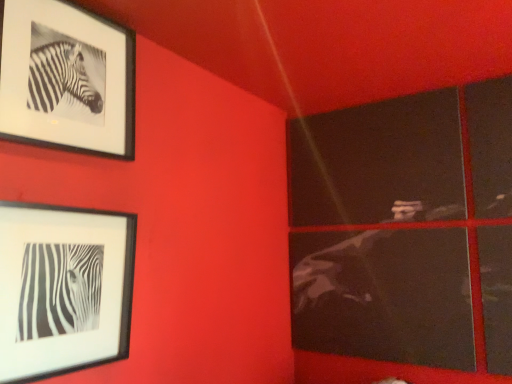
Where is `black matte picture frame at upper left, which is counted as the 1th picture frame, starting from the top`? This screenshot has height=384, width=512. black matte picture frame at upper left, which is counted as the 1th picture frame, starting from the top is located at coordinates (67, 78).

What do you see at coordinates (67, 78) in the screenshot? This screenshot has width=512, height=384. I see `black matte picture frame at upper left, arranged as the 2th picture frame when ordered from the bottom` at bounding box center [67, 78].

Locate an element on the screen. black matte picture frame at lower left, placed as the first picture frame when sorted from bottom to top is located at coordinates (63, 289).

What do you see at coordinates (63, 289) in the screenshot? I see `black matte picture frame at lower left, the 2th picture frame from the top` at bounding box center [63, 289].

Image resolution: width=512 pixels, height=384 pixels. What are the coordinates of `black matte picture frame at upper left, arranged as the 2th picture frame when ordered from the bottom` in the screenshot? It's located at (67, 78).

In the image, is black matte picture frame at lower left, placed as the first picture frame when sorted from bottom to top, on the left side or the right side of black matte picture frame at upper left, arranged as the 2th picture frame when ordered from the bottom?

From the image, it's evident that black matte picture frame at lower left, placed as the first picture frame when sorted from bottom to top, is to the right of black matte picture frame at upper left, arranged as the 2th picture frame when ordered from the bottom.

Is black matte picture frame at lower left, the 2th picture frame from the top, further to camera compared to black matte picture frame at upper left, which is counted as the 1th picture frame, starting from the top?

No.

Considering the points (124, 244) and (6, 21), which point is behind, point (124, 244) or point (6, 21)?

Positioned behind is point (124, 244).

From the image's perspective, between black matte picture frame at lower left, the 2th picture frame from the top, and black matte picture frame at upper left, which is counted as the 1th picture frame, starting from the top, which one is located above?

black matte picture frame at upper left, which is counted as the 1th picture frame, starting from the top, from the image's perspective.

From a real-world perspective, which object rests below the other?

black matte picture frame at lower left, the 2th picture frame from the top.

Considering the sizes of black matte picture frame at lower left, the 2th picture frame from the top, and black matte picture frame at upper left, which is counted as the 1th picture frame, starting from the top, in the image, is black matte picture frame at lower left, the 2th picture frame from the top, wider or thinner than black matte picture frame at upper left, which is counted as the 1th picture frame, starting from the top,?

black matte picture frame at lower left, the 2th picture frame from the top, is wider than black matte picture frame at upper left, which is counted as the 1th picture frame, starting from the top.

Between black matte picture frame at lower left, the 2th picture frame from the top, and black matte picture frame at upper left, which is counted as the 1th picture frame, starting from the top, which one has less height?

black matte picture frame at lower left, the 2th picture frame from the top.

Is black matte picture frame at lower left, the 2th picture frame from the top, smaller than black matte picture frame at upper left, which is counted as the 1th picture frame, starting from the top?

No.

Is black matte picture frame at lower left, the 2th picture frame from the top, not inside black matte picture frame at upper left, which is counted as the 1th picture frame, starting from the top?

Yes, black matte picture frame at lower left, the 2th picture frame from the top, is not within black matte picture frame at upper left, which is counted as the 1th picture frame, starting from the top.

Are black matte picture frame at lower left, placed as the first picture frame when sorted from bottom to top, and black matte picture frame at upper left, arranged as the 2th picture frame when ordered from the bottom, beside each other?

No, black matte picture frame at lower left, placed as the first picture frame when sorted from bottom to top, is not beside black matte picture frame at upper left, arranged as the 2th picture frame when ordered from the bottom.

Is black matte picture frame at lower left, the 2th picture frame from the top, positioned with its back to black matte picture frame at upper left, arranged as the 2th picture frame when ordered from the bottom?

No, black matte picture frame at lower left, the 2th picture frame from the top, is not facing the opposite direction of black matte picture frame at upper left, arranged as the 2th picture frame when ordered from the bottom.

Measure the distance from black matte picture frame at lower left, the 2th picture frame from the top, to black matte picture frame at upper left, arranged as the 2th picture frame when ordered from the bottom.

black matte picture frame at lower left, the 2th picture frame from the top, and black matte picture frame at upper left, arranged as the 2th picture frame when ordered from the bottom, are 18.04 inches apart from each other.

Where is `picture frame located in front of the black matte picture frame at upper left, which is counted as the 1th picture frame, starting from the top`? This screenshot has width=512, height=384. picture frame located in front of the black matte picture frame at upper left, which is counted as the 1th picture frame, starting from the top is located at coordinates (63, 289).

Based on the photo, is black matte picture frame at upper left, which is counted as the 1th picture frame, starting from the top, to the right of black matte picture frame at lower left, the 2th picture frame from the top, from the viewer's perspective?

In fact, black matte picture frame at upper left, which is counted as the 1th picture frame, starting from the top, is to the left of black matte picture frame at lower left, the 2th picture frame from the top.

Is black matte picture frame at upper left, arranged as the 2th picture frame when ordered from the bottom, positioned in front of black matte picture frame at lower left, placed as the first picture frame when sorted from bottom to top?

No, the depth of black matte picture frame at upper left, arranged as the 2th picture frame when ordered from the bottom, is greater than that of black matte picture frame at lower left, placed as the first picture frame when sorted from bottom to top.

Considering the points (105, 40) and (91, 262), which point is behind, point (105, 40) or point (91, 262)?

The point (105, 40) is farther from the camera.

From the image's perspective, is black matte picture frame at upper left, which is counted as the 1th picture frame, starting from the top, above black matte picture frame at lower left, the 2th picture frame from the top?

Yes.

From a real-world perspective, is black matte picture frame at upper left, which is counted as the 1th picture frame, starting from the top, physically located above or below black matte picture frame at lower left, placed as the first picture frame when sorted from bottom to top?

black matte picture frame at upper left, which is counted as the 1th picture frame, starting from the top, is situated higher than black matte picture frame at lower left, placed as the first picture frame when sorted from bottom to top, in the real world.

In the scene shown: Does black matte picture frame at upper left, arranged as the 2th picture frame when ordered from the bottom, have a greater width compared to black matte picture frame at lower left, the 2th picture frame from the top?

No.

Who is taller, black matte picture frame at upper left, arranged as the 2th picture frame when ordered from the bottom, or black matte picture frame at lower left, placed as the first picture frame when sorted from bottom to top?

Standing taller between the two is black matte picture frame at upper left, arranged as the 2th picture frame when ordered from the bottom.

Can you confirm if black matte picture frame at upper left, which is counted as the 1th picture frame, starting from the top, is bigger than black matte picture frame at lower left, placed as the first picture frame when sorted from bottom to top?

No.

Is black matte picture frame at upper left, which is counted as the 1th picture frame, starting from the top, situated inside black matte picture frame at lower left, placed as the first picture frame when sorted from bottom to top, or outside?

black matte picture frame at upper left, which is counted as the 1th picture frame, starting from the top, lies outside black matte picture frame at lower left, placed as the first picture frame when sorted from bottom to top.

Are black matte picture frame at upper left, arranged as the 2th picture frame when ordered from the bottom, and black matte picture frame at lower left, placed as the first picture frame when sorted from bottom to top, beside each other?

black matte picture frame at upper left, arranged as the 2th picture frame when ordered from the bottom, is not next to black matte picture frame at lower left, placed as the first picture frame when sorted from bottom to top, and they're not touching.

Is black matte picture frame at upper left, arranged as the 2th picture frame when ordered from the bottom, turned away from black matte picture frame at lower left, placed as the first picture frame when sorted from bottom to top?

black matte picture frame at upper left, arranged as the 2th picture frame when ordered from the bottom, is not turned away from black matte picture frame at lower left, placed as the first picture frame when sorted from bottom to top.

Measure the distance between black matte picture frame at upper left, which is counted as the 1th picture frame, starting from the top, and black matte picture frame at lower left, the 2th picture frame from the top.

black matte picture frame at upper left, which is counted as the 1th picture frame, starting from the top, and black matte picture frame at lower left, the 2th picture frame from the top, are 45.83 centimeters apart from each other.

You are a GUI agent. You are given a task and a screenshot of the screen. Output one action in this format:
    pyautogui.click(x=<x>, y=<y>)
    Task: Click on the picture frame that appears below the black matte picture frame at upper left, arranged as the 2th picture frame when ordered from the bottom (from the image's perspective)
    
    Given the screenshot: What is the action you would take?
    pyautogui.click(x=63, y=289)

You are a GUI agent. You are given a task and a screenshot of the screen. Output one action in this format:
    pyautogui.click(x=<x>, y=<y>)
    Task: Click on the picture frame behind the black matte picture frame at lower left, placed as the first picture frame when sorted from bottom to top
    
    Given the screenshot: What is the action you would take?
    pyautogui.click(x=67, y=78)

At what (x,y) coordinates should I click in order to perform the action: click on picture frame above the black matte picture frame at lower left, the 2th picture frame from the top (from the image's perspective). Please return your answer as a coordinate pair (x, y). Looking at the image, I should click on (67, 78).